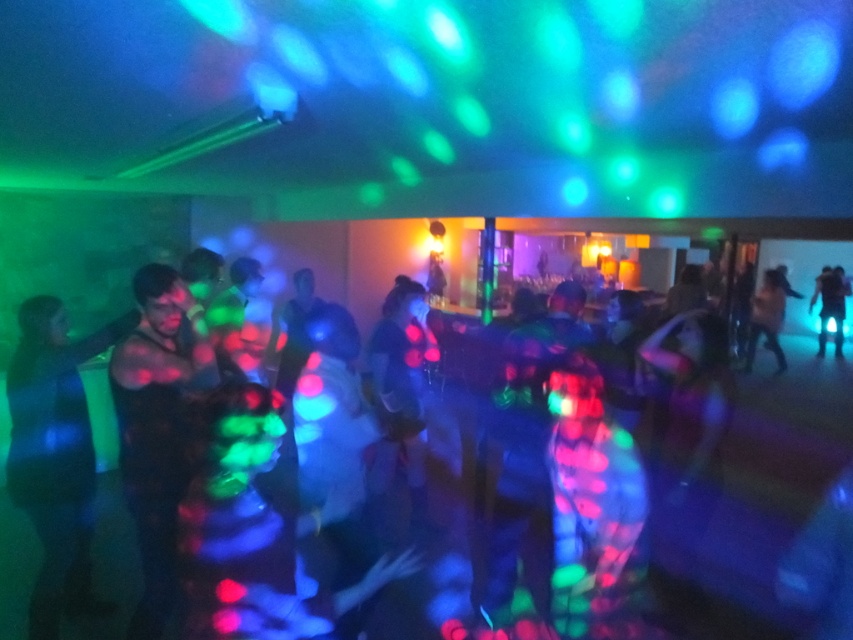
Question: Which point appears farthest from the camera in this image?

Choices:
 (A) 96,600
 (B) 161,294

Answer: (A)

Question: Is neon glow clothing at center smaller than shiny blue dress at left?

Choices:
 (A) yes
 (B) no

Answer: (B)

Question: Which point is closer to the camera?

Choices:
 (A) (142, 460)
 (B) (19, 548)
 (C) (819, 291)

Answer: (A)

Question: Is shiny blue dress at left to the left of blue reflective pants at right from the viewer's perspective?

Choices:
 (A) no
 (B) yes

Answer: (B)

Question: Estimate the real-world distances between objects in this image. Which object is farther from the shiny metallic tank top at center?

Choices:
 (A) shiny blue dress at left
 (B) neon glow clothing at center

Answer: (B)

Question: Can you confirm if shiny blue dress at left is bigger than blue reflective pants at right?

Choices:
 (A) no
 (B) yes

Answer: (A)